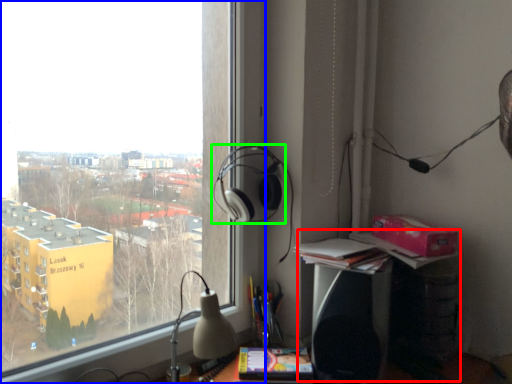
Question: Based on their relative distances, which object is nearer to computer desk (highlighted by a red box)? Choose from window (highlighted by a blue box) and headphones (highlighted by a green box).

Choices:
 (A) window
 (B) headphones

Answer: (B)